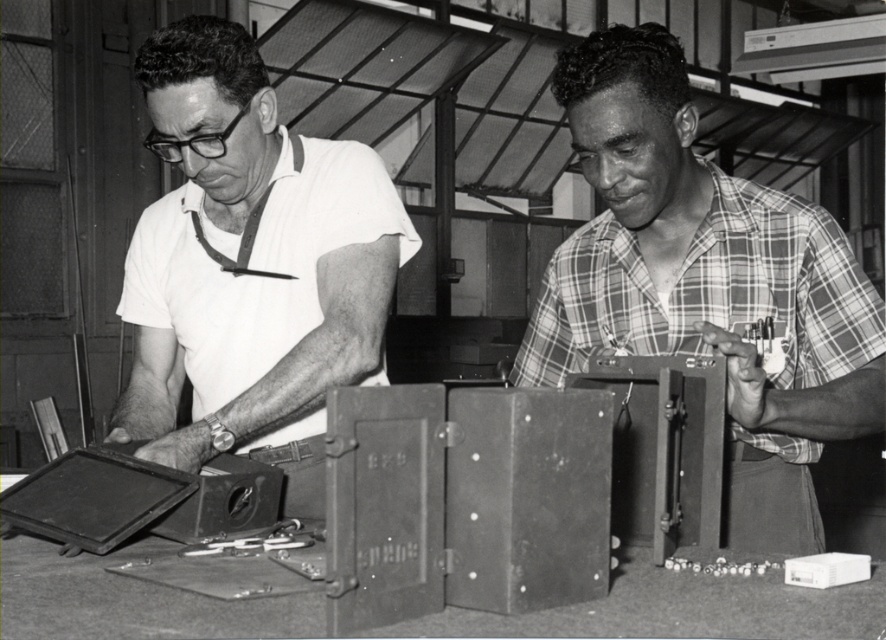
Who is higher up, plaid shirt at center or matte white shirt at left?

matte white shirt at left is above.

Can you confirm if plaid shirt at center is shorter than matte white shirt at left?

Yes, plaid shirt at center is shorter than matte white shirt at left.

At what (x,y) coordinates should I click in order to perform the action: click on plaid shirt at center. Please return your answer as a coordinate pair (x, y). Looking at the image, I should click on (706, 284).

Where is `plaid shirt at center`? The height and width of the screenshot is (640, 886). plaid shirt at center is located at coordinates (706, 284).